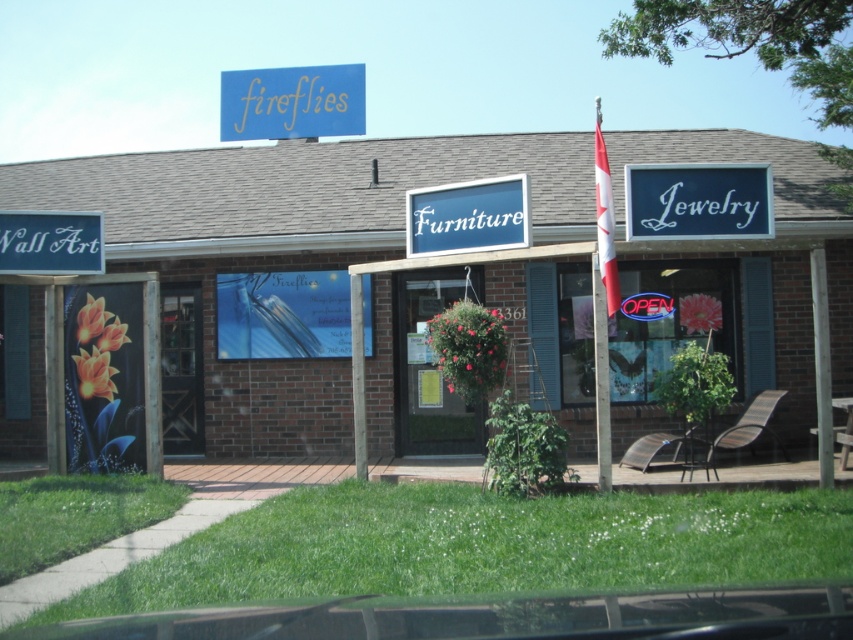
Does point (738, 198) lie in front of point (30, 244)?

That is True.

This screenshot has width=853, height=640. What do you see at coordinates (698, 200) in the screenshot? I see `blue/white sign at upper right` at bounding box center [698, 200].

Find the location of a particular element. The height and width of the screenshot is (640, 853). blue/white sign at upper right is located at coordinates (698, 200).

Consider the image. Between blue matte sign at upper center and white matte wall art at left, which one is positioned higher?

blue matte sign at upper center is above.

Does point (331, 96) come farther from viewer compared to point (73, 228)?

Yes, it is.

Identify the location of blue matte sign at upper center. The width and height of the screenshot is (853, 640). (292, 102).

Measure the distance between white plastic signboard at center and camera.

white plastic signboard at center is 29.01 feet from camera.

Between white plastic signboard at center and white matte wall art at left, which one has less height?

white matte wall art at left

Find the location of a particular element. This screenshot has width=853, height=640. white plastic signboard at center is located at coordinates (468, 216).